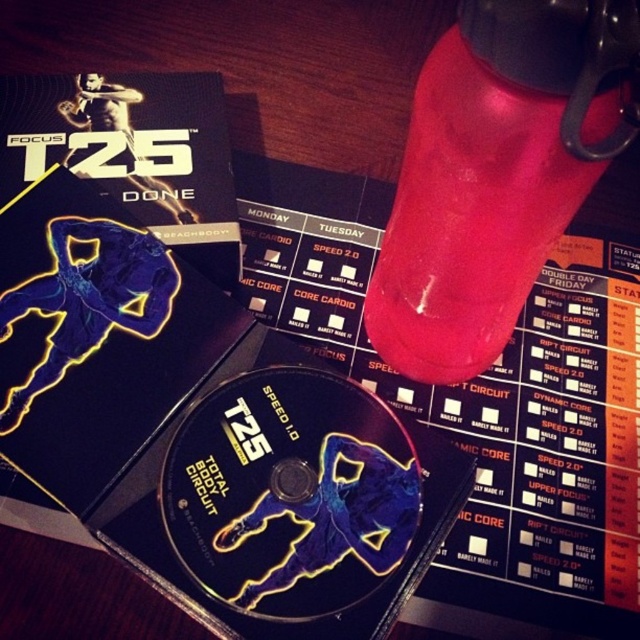
You are organizing a fitness event and need to place a 10cm tall trophy on the wooden surface. The trophy must be placed between the red matte water bottle at upper right and the shiny black cd at center. Can you fit it there?

The red matte water bottle at upper right is closer to the viewer than the shiny black cd at center, so there is enough space between them to place the 10cm tall trophy.

You are organizing a fitness event and need to place the red matte water bottle at upper right and the shiny black cd at center into a storage box. The box has a height limit of 12 cm. Can you determine if both items will fit vertically without exceeding the box height?

The red matte water bottle at upper right is larger in size than the shiny black cd at center. However, the exact dimensions of both items are not provided. Therefore, it is uncertain if they will fit within the 12 cm height limit. Additional measurements are needed to confirm.

You are organizing a fitness event and need to place the red matte water bottle at upper right and the shiny black cd at center on a table. According to the scene, where should you place the red matte water bottle relative to the shiny black cd?

The red matte water bottle at upper right should be placed on the right side of the shiny black cd at center as per the scene description.